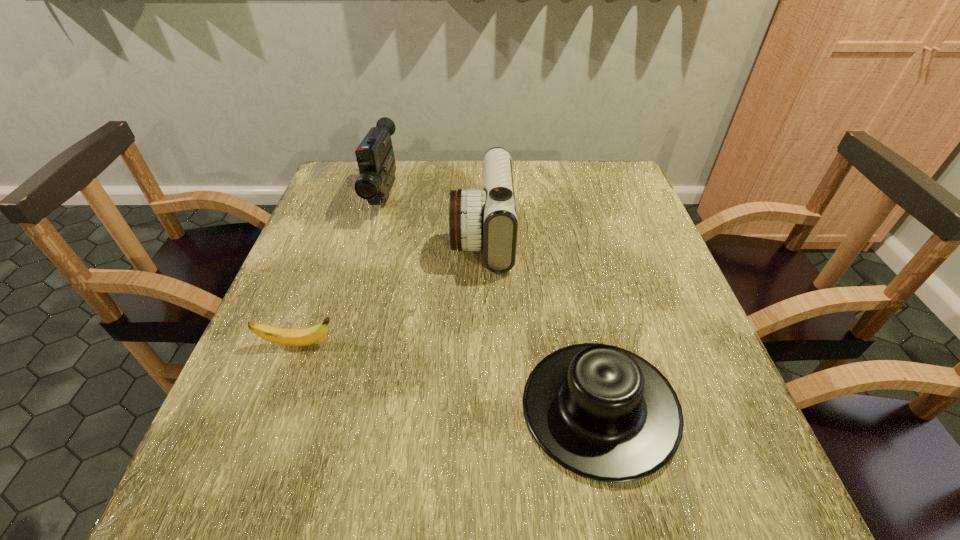
The width and height of the screenshot is (960, 540). I want to click on empty space between the second shortest object and the right camcorder, so click(541, 321).

Find the location of `free space between the right camcorder and the left camcorder`. free space between the right camcorder and the left camcorder is located at coordinates (433, 216).

Find the location of `blank region between the left camcorder and the second shortest object`. blank region between the left camcorder and the second shortest object is located at coordinates (492, 301).

Where is `unoccupied position between the right camcorder and the second shortest object`? This screenshot has height=540, width=960. unoccupied position between the right camcorder and the second shortest object is located at coordinates (541, 321).

You are a GUI agent. You are given a task and a screenshot of the screen. Output one action in this format:
    pyautogui.click(x=<x>, y=<y>)
    Task: Click on the free area in between the banana and the left camcorder
    
    Given the screenshot: What is the action you would take?
    pyautogui.click(x=341, y=270)

The width and height of the screenshot is (960, 540). Identify the location of blank region between the shortest object and the right camcorder. pyautogui.click(x=391, y=290).

You are a GUI agent. You are given a task and a screenshot of the screen. Output one action in this format:
    pyautogui.click(x=<x>, y=<y>)
    Task: Click on the empty space between the banana and the left camcorder
    The height and width of the screenshot is (540, 960).
    Given the screenshot: What is the action you would take?
    pyautogui.click(x=341, y=270)

The width and height of the screenshot is (960, 540). I want to click on free space between the shortest object and the left camcorder, so click(x=341, y=270).

Where is `free space between the right camcorder and the dress hat`? free space between the right camcorder and the dress hat is located at coordinates (541, 321).

I want to click on free spot between the shortest object and the third tallest object, so click(x=449, y=375).